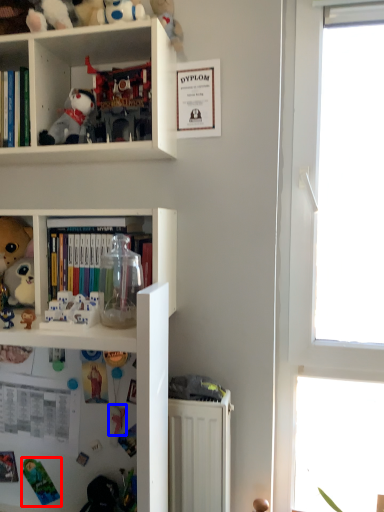
Question: Which of the following is the farthest to the observer, toy (highlighted by a red box) or toy (highlighted by a blue box)?

Choices:
 (A) toy
 (B) toy

Answer: (A)